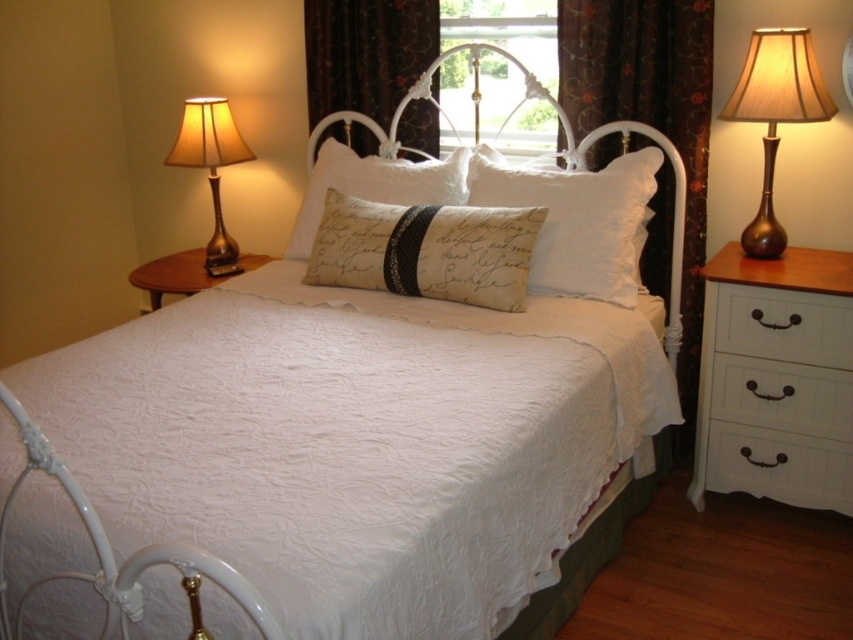
Question: In this image, where is beige fabric pillow with script at center located relative to white wood drawer at right?

Choices:
 (A) left
 (B) right

Answer: (A)

Question: Can you confirm if white cotton pillow at center is positioned above matte gold lamp at left?

Choices:
 (A) no
 (B) yes

Answer: (A)

Question: Which point is farther from the camera taking this photo?

Choices:
 (A) (791, 356)
 (B) (428, 132)
 (C) (212, 109)
 (D) (833, 508)

Answer: (C)

Question: Estimate the real-world distances between objects in this image. Which object is closer to the clear glass window at center?

Choices:
 (A) gold metallic lamp at right
 (B) white cotton pillow at center
 (C) white painted wood drawer at lower right

Answer: (B)

Question: Is white painted wood dresser at right to the right of dark floral fabric curtain at upper center from the viewer's perspective?

Choices:
 (A) yes
 (B) no

Answer: (A)

Question: Which point is farther from the camera taking this photo?

Choices:
 (A) (206, 131)
 (B) (404, 132)

Answer: (B)